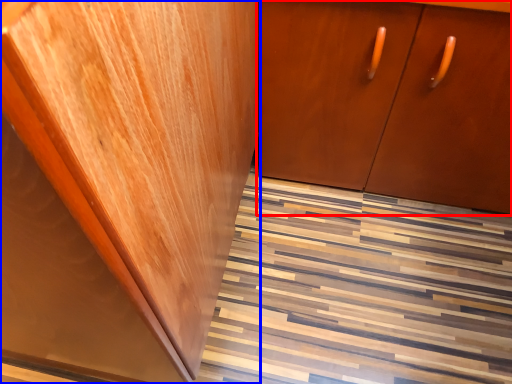
Question: Which object appears closest to the camera in this image, cabinetry (highlighted by a red box) or cabinetry (highlighted by a blue box)?

Choices:
 (A) cabinetry
 (B) cabinetry

Answer: (B)